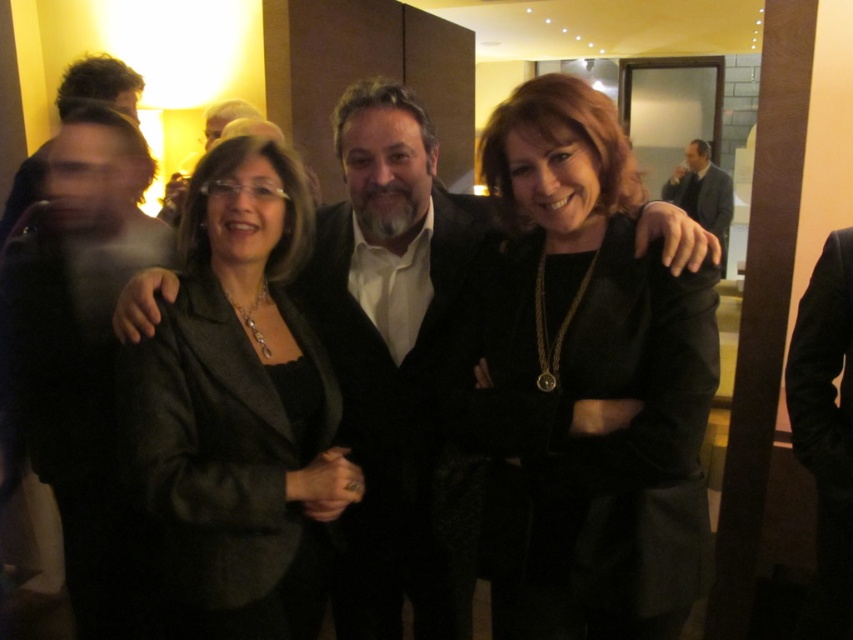
Does black wool suit at center have a lesser width compared to black wool suit at right?

Incorrect, black wool suit at center's width is not less than black wool suit at right's.

Describe the element at coordinates (399, 426) in the screenshot. I see `black wool suit at center` at that location.

Is point (454, 596) in front of point (842, 589)?

No, (454, 596) is further to viewer.

Find the location of a particular element. The image size is (853, 640). black wool suit at center is located at coordinates (399, 426).

Is point (96, 214) positioned behind point (845, 234)?

Yes, it is behind point (845, 234).

Identify the location of matte black suit at left. (80, 352).

At what (x,y) coordinates should I click in order to perform the action: click on matte black suit at left. Please return your answer as a coordinate pair (x, y). The image size is (853, 640). Looking at the image, I should click on (80, 352).

Is the position of matte black blazer at center less distant than that of matte black suit at left?

Yes, matte black blazer at center is closer to the viewer.

Looking at this image, which of these two, matte black blazer at center or matte black suit at left, stands shorter?

With less height is matte black blazer at center.

Who is more forward, (299,396) or (35,321)?

Point (299,396) is more forward.

I want to click on matte black blazer at center, so click(x=239, y=410).